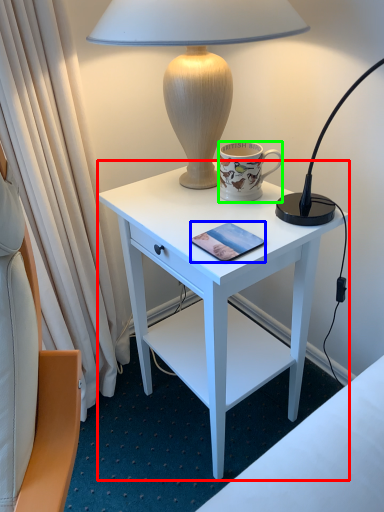
Question: Which is nearer to the desk (highlighted by a red box)? pad (highlighted by a blue box) or coffee cup (highlighted by a green box).

Choices:
 (A) pad
 (B) coffee cup

Answer: (B)